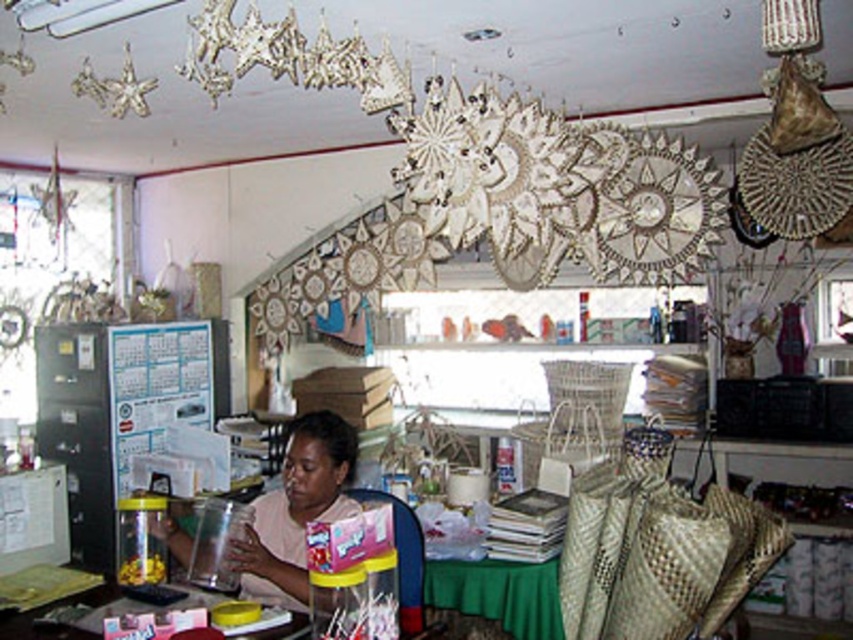
Does point (32, 630) lie in front of point (415, 618)?

That is True.

Between point (68, 596) and point (403, 570), which one is positioned behind?

The point (403, 570) is behind.

Based on the photo, who is more forward, [97,625] or [366,492]?

Positioned in front is point [97,625].

You are a GUI agent. You are given a task and a screenshot of the screen. Output one action in this format:
    pyautogui.click(x=<x>, y=<y>)
    Task: Click on the translucent plastic table at center
    This screenshot has width=853, height=640.
    Given the screenshot: What is the action you would take?
    67,618

Is matte pink shirt at center above translucent plastic table at center?

Yes, matte pink shirt at center is above translucent plastic table at center.

Does matte pink shirt at center appear under translucent plastic table at center?

Actually, matte pink shirt at center is above translucent plastic table at center.

Measure the distance between point (258,499) and camera.

Point (258,499) is 2.83 meters away from camera.

What are the coordinates of `matte pink shirt at center` in the screenshot? It's located at (296, 509).

This screenshot has width=853, height=640. I want to click on matte pink shirt at center, so click(x=296, y=509).

Does point (306, 605) come in front of point (419, 538)?

Yes, point (306, 605) is closer to viewer.

Find the location of `matte pink shirt at center`. matte pink shirt at center is located at coordinates (296, 509).